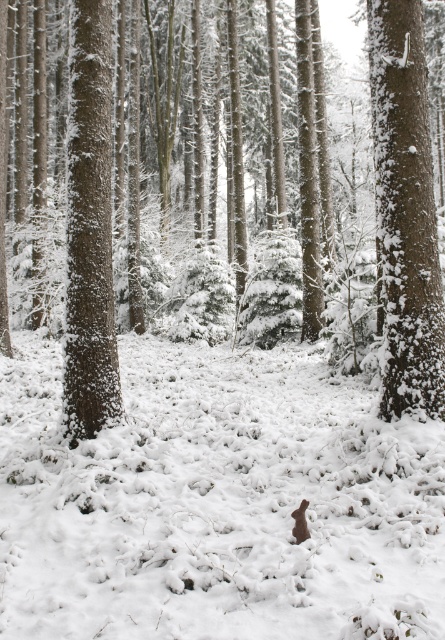
Question: Can you confirm if snow-covered bark tree at upper right is smaller than smooth brown tree trunk at left?

Choices:
 (A) yes
 (B) no

Answer: (B)

Question: Does snow-covered bark tree at upper right appear on the right side of brown furry rabbit at center?

Choices:
 (A) yes
 (B) no

Answer: (A)

Question: Does white fluffy snow at center appear on the right side of snow-covered bark tree at upper right?

Choices:
 (A) yes
 (B) no

Answer: (B)

Question: Which point appears farthest from the camera in this image?

Choices:
 (A) (217, 528)
 (B) (79, 184)

Answer: (B)

Question: Among these objects, which one is nearest to the camera?

Choices:
 (A) snow-covered bark tree at upper right
 (B) white fluffy snow at center
 (C) brown furry rabbit at center

Answer: (B)

Question: Which object is closer to the camera taking this photo?

Choices:
 (A) snow-covered bark tree at upper right
 (B) brown furry rabbit at center
 (C) smooth brown tree trunk at left

Answer: (B)